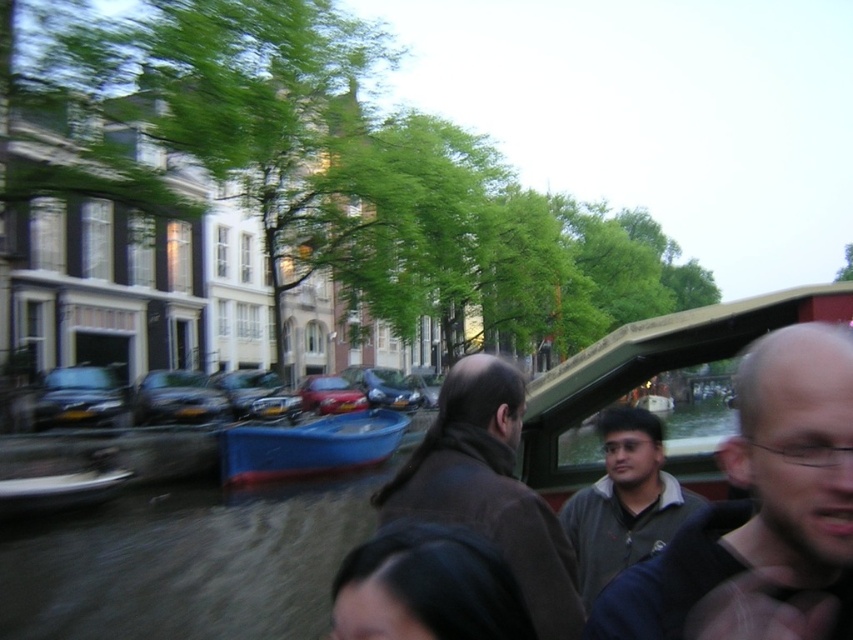
You are a photographer trying to capture a photo of the brown wool coat at center and the blue plastic boat at center. If you want to ensure both are fully visible in the frame, which object should you adjust your focus on to avoid cropping?

The brown wool coat at center is shorter than the blue plastic boat at center, so you should focus on the blue plastic boat at center to ensure both are fully visible in the frame.

You are standing at the point labeled as point (761, 513) in the image. What object is located at this point?

The point (761, 513) corresponds to the dark gray sweater at center.

You are a photographer trying to capture a photo of the dark gray sweater at center and the blue plastic boat at center. Which object should you focus on first if you want to ensure both are in focus without adjusting the camera settings?

The dark gray sweater at center is shorter than the blue plastic boat at center, so you should focus on the blue plastic boat at center first to ensure both are in focus.